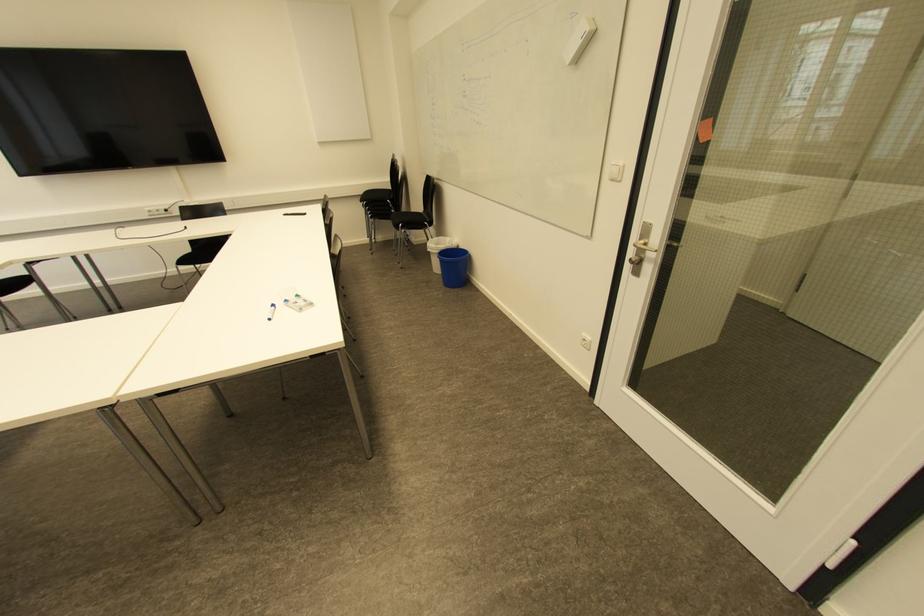
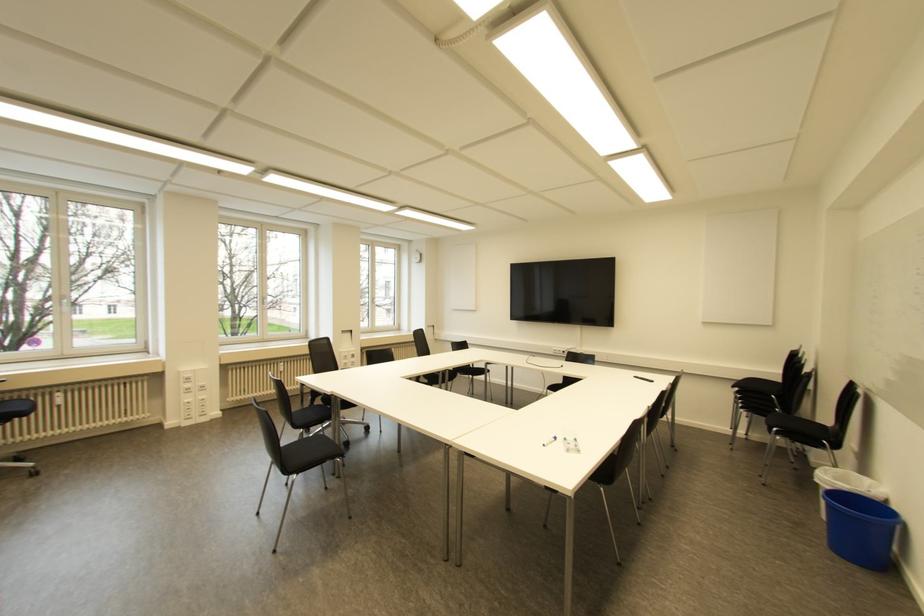
Locate, in the second image, the point that corresponds to (456,265) in the first image.

(864, 527)